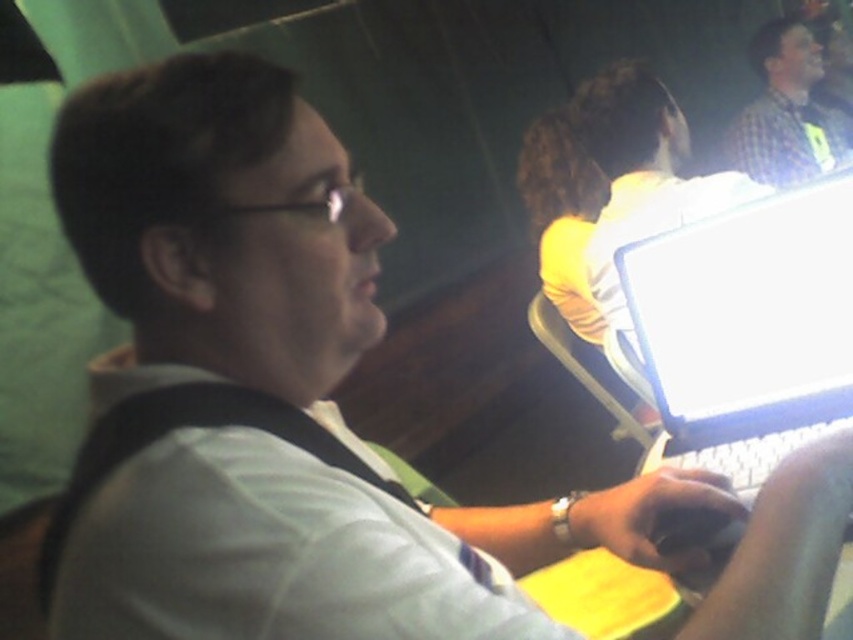
You are a photographer trying to capture a clear shot of the white glossy laptop at center. You have a camera that can focus on objects up to 30 inches away. Are you able to focus on the laptop from your current position?

The white glossy laptop at center and camera are 32.68 inches apart from each other. Since the camera can focus up to 30 inches away, you are too far to focus on the laptop.

You are trying to determine the relative sizes of objects in the image. Given the white glossy laptop at center and the checkered shirt at upper right, which one is smaller?

The white glossy laptop at center is smaller than the checkered shirt at upper right.

You are trying to place a new laptop that is 12 inches wide on the table in front of you. The white glossy laptop at center and the checkered shirt at upper right are in your view. Can the new laptop fit on the table if the table is 14 inches wide?

The white glossy laptop at center is narrower than the checkered shirt at upper right. However, since the table is 14 inches wide and the new laptop is 12 inches wide, the new laptop can fit on the table as long as there is enough space not occupied by the existing objects.